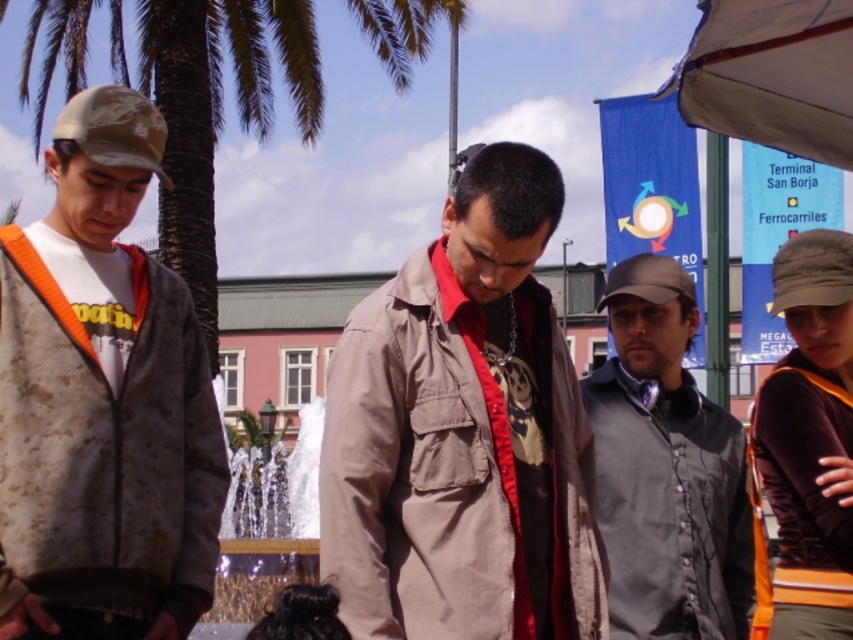
You are a photographer trying to capture the metallic reflective water at center without the green leafy palm tree at upper left appearing in the reflection. Is this possible based on the scene?

The green leafy palm tree at upper left is positioned over the metallic reflective water at center, so its reflection would likely be visible in the water. To avoid capturing the palm tree in the reflection, the photographer would need to adjust their angle or position to exclude the tree from the reflective surface.

You are standing in a public space and see the green leafy palm tree at upper left. If you want to take a photo of it without any obstructions, would you need to move closer or farther away?

The green leafy palm tree at upper left is 72.92 meters from camera. To take a photo without obstructions, you might need to move closer to reduce the distance and ensure the tree is the main focus without nearby objects blocking the view.

You are standing in the plaza and want to locate the beige fabric canopy at upper right. Based on the coordinates provided, in which direction should you look to find it?

The beige fabric canopy at upper right is located at coordinates point (770, 76), so you should look towards the upper right direction to find it.